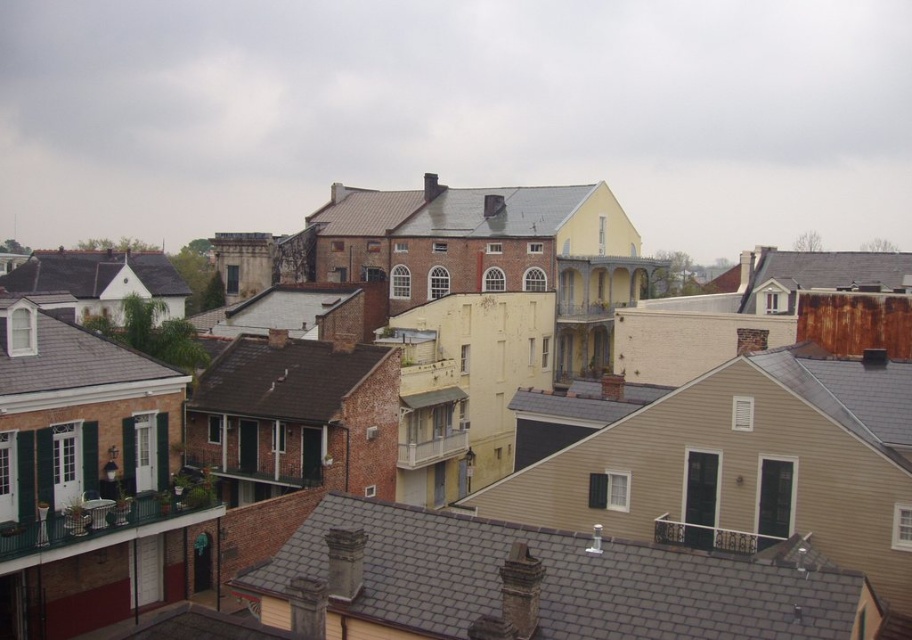
Question: Among these points, which one is farthest from the camera?

Choices:
 (A) (443, 609)
 (B) (263, 356)
 (C) (132, 259)
 (D) (26, 387)

Answer: (C)

Question: In this image, where is brown brick roof at center located relative to white shingles at lower left?

Choices:
 (A) below
 (B) above

Answer: (A)

Question: Does gray slate roof at center appear on the right side of brown brick roof at center?

Choices:
 (A) no
 (B) yes

Answer: (B)

Question: Is brown brick roof at center behind white shingles at lower left?

Choices:
 (A) yes
 (B) no

Answer: (A)

Question: Which object is farther from the camera taking this photo?

Choices:
 (A) brown brick roof at center
 (B) gray slate roof at center
 (C) shiny black roof at left

Answer: (C)

Question: Among these objects, which one is farthest from the camera?

Choices:
 (A) gray slate roof at center
 (B) brown brick roof at center

Answer: (B)